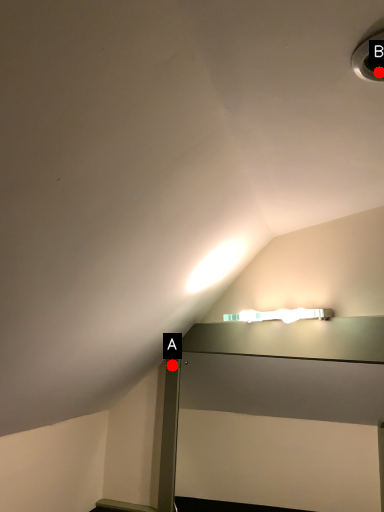
Question: Two points are circled on the image, labeled by A and B beside each circle. Which point is closer to the camera taking this photo?

Choices:
 (A) A is closer
 (B) B is closer

Answer: (B)